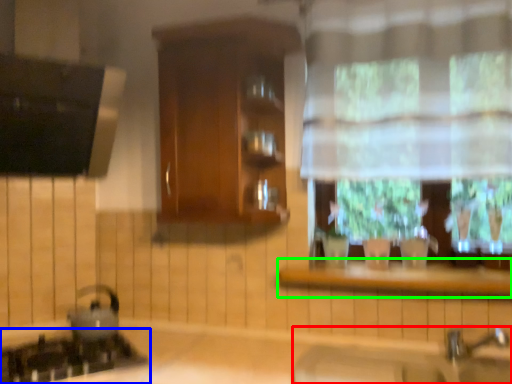
Question: Considering the real-world distances, which object is farthest from sink (highlighted by a red box)? gas stove (highlighted by a blue box) or window sill (highlighted by a green box)?

Choices:
 (A) gas stove
 (B) window sill

Answer: (A)